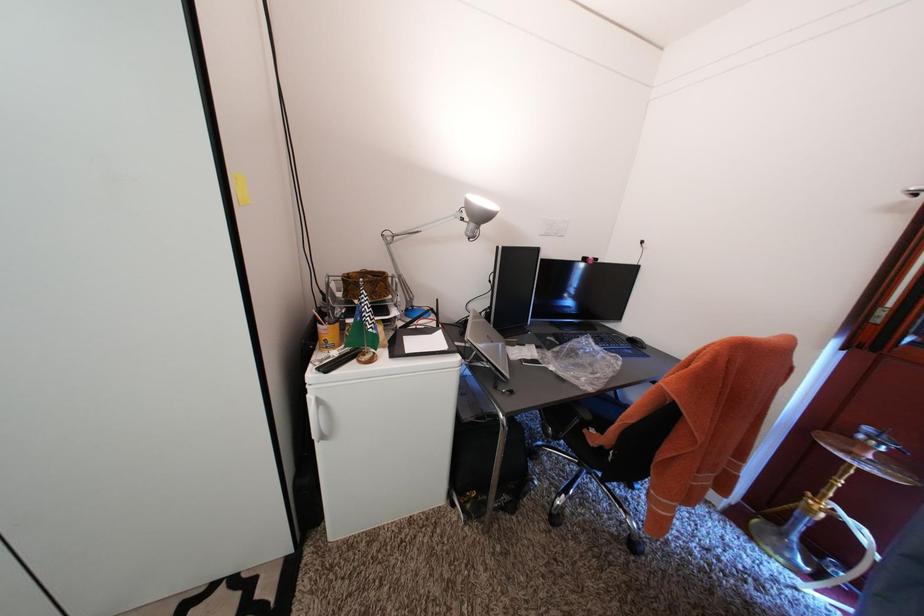
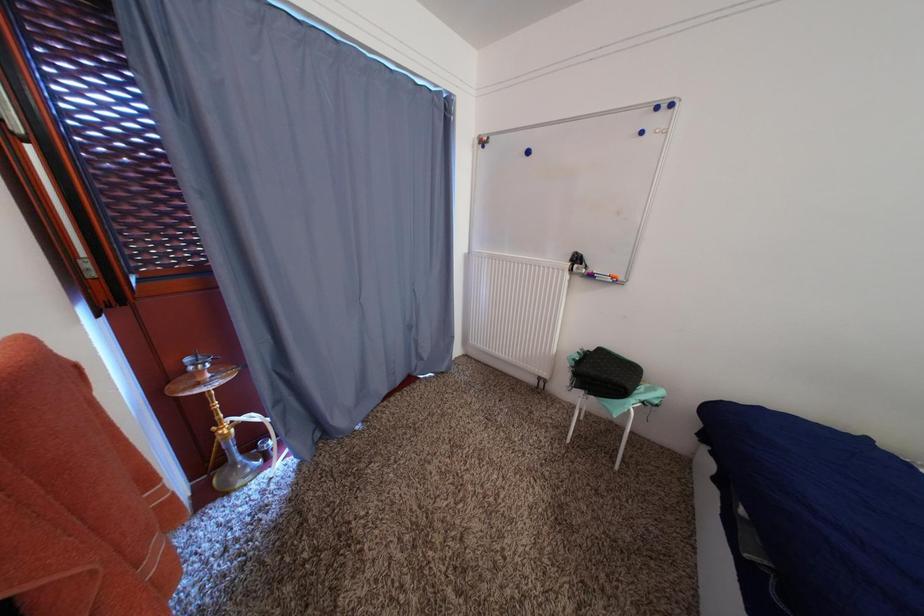
How did the camera likely rotate?

The rotation direction of the camera is right-down.